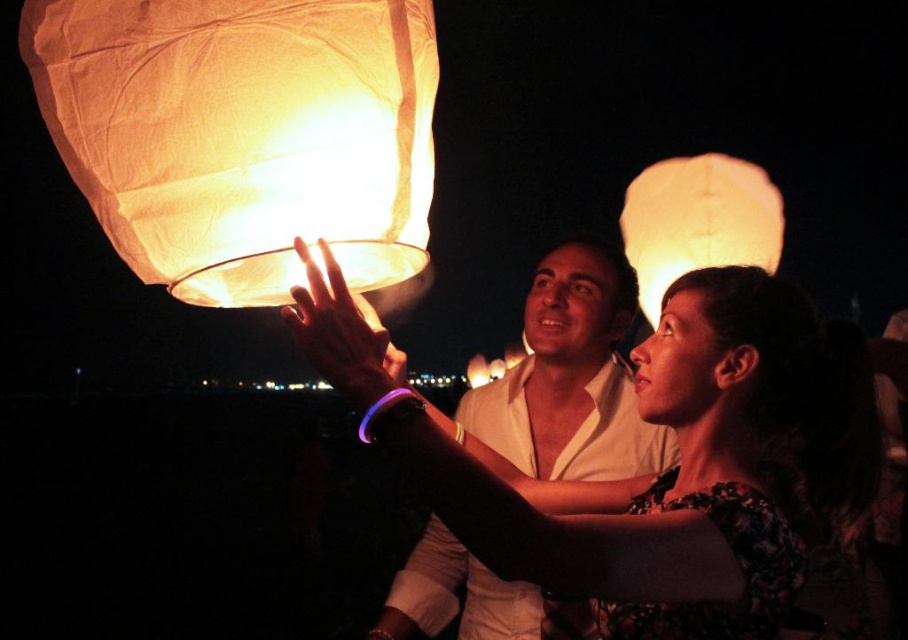
Can you confirm if matte paper lantern at upper left is positioned to the right of matte white shirt at center?

In fact, matte paper lantern at upper left is to the left of matte white shirt at center.

Find the location of a particular element. This screenshot has height=640, width=908. matte paper lantern at upper left is located at coordinates (243, 134).

Which is below, matte paper lantern at upper left or matte white lantern at upper right?

matte paper lantern at upper left is lower down.

Where is `matte paper lantern at upper left`? The width and height of the screenshot is (908, 640). matte paper lantern at upper left is located at coordinates (243, 134).

Between matte white shirt at center and matte white lantern at upper right, which one has more height?

A: With more height is matte white lantern at upper right.

In order to click on matte white shirt at center in this screenshot , I will do `click(571, 378)`.

At what (x,y) coordinates should I click in order to perform the action: click on matte white shirt at center. Please return your answer as a coordinate pair (x, y). The width and height of the screenshot is (908, 640). Looking at the image, I should click on (571, 378).